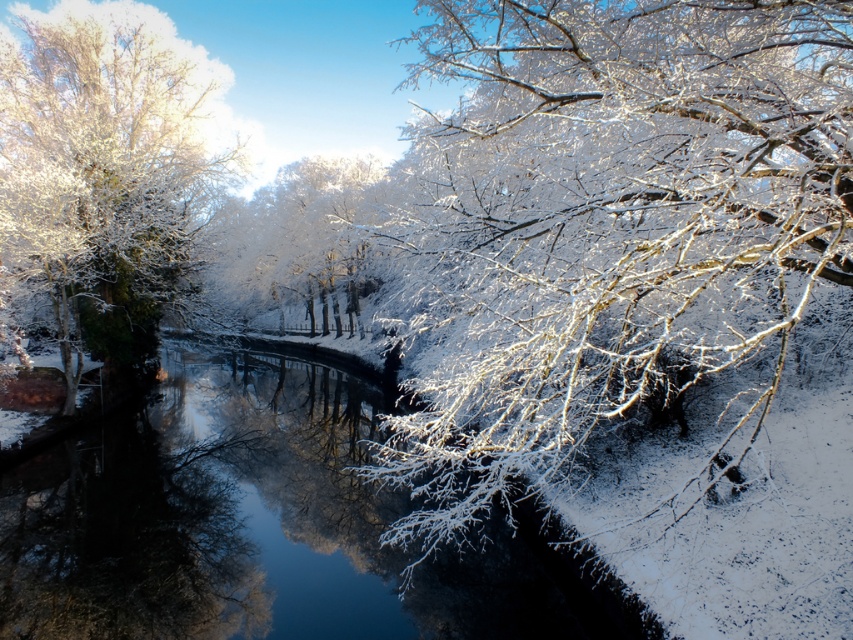
You are an observer standing on the riverbank looking at the clear ice water at center and the white frosty tree at left. Which object is closer to the ground?

The clear ice water at center is closer to the ground because it is located below the white frosty tree at left.

You are an artist sketching this winter scene. You want to ensure the white frosty branches at upper right and the white frosty tree at left are proportionally accurate. Which object should you draw wider in your sketch?

The white frosty branches at upper right should be drawn wider since their width surpasses that of the white frosty tree at left.